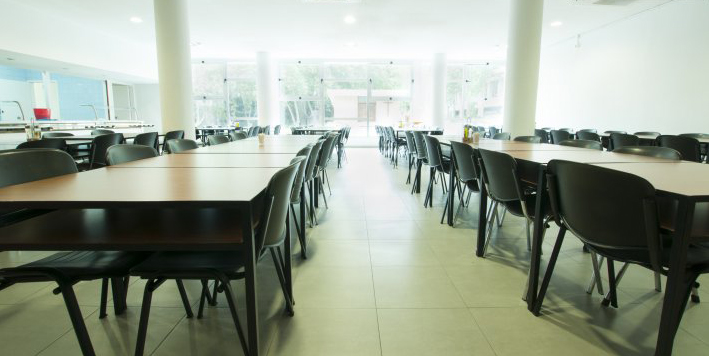
Where is `tables`? tables is located at coordinates (199, 185), (225, 154), (250, 144), (679, 167), (569, 157), (507, 142).